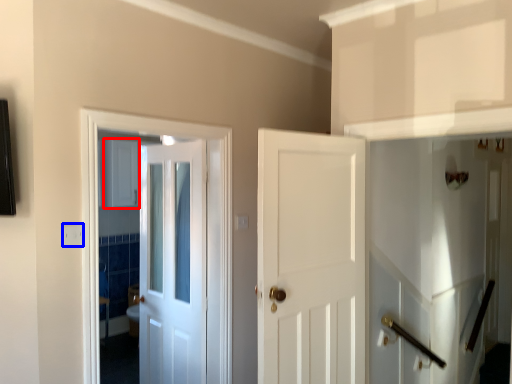
Question: Which object appears farthest to the camera in this image, cabinetry (highlighted by a red box) or electric outlet (highlighted by a blue box)?

Choices:
 (A) cabinetry
 (B) electric outlet

Answer: (A)